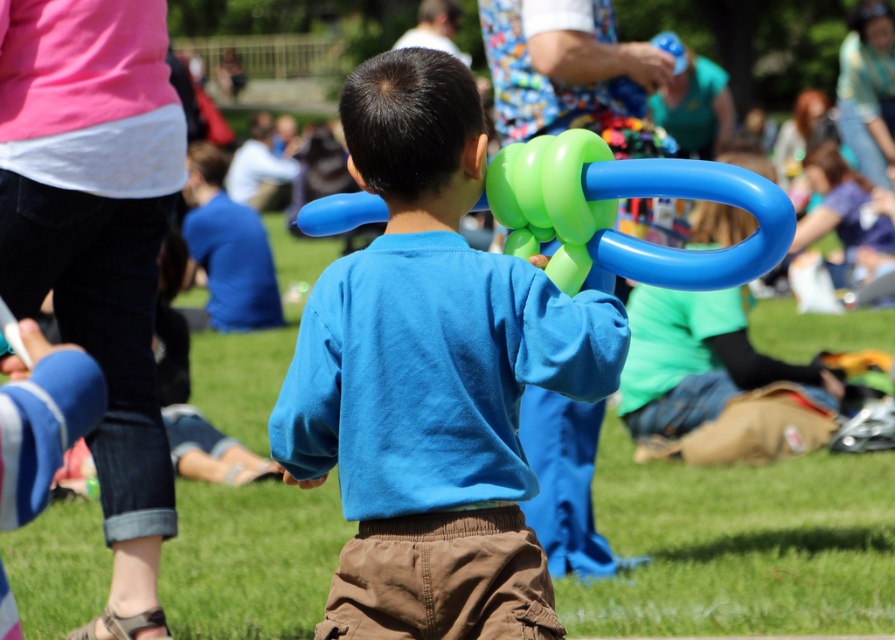
Question: Does blue matte balloon at center appear on the left side of green rubber balloon at center?

Choices:
 (A) yes
 (B) no

Answer: (A)

Question: Which point is closer to the camera?

Choices:
 (A) (594, 259)
 (B) (587, 396)

Answer: (B)

Question: Which point is closer to the camera taking this photo?

Choices:
 (A) (303, 468)
 (B) (659, 253)

Answer: (B)

Question: Can you confirm if blue matte balloon at center is positioned to the right of green rubber balloon at center?

Choices:
 (A) yes
 (B) no

Answer: (B)

Question: Can you confirm if blue matte balloon at center is positioned to the right of green rubber balloon at center?

Choices:
 (A) no
 (B) yes

Answer: (A)

Question: Which object appears farthest from the camera in this image?

Choices:
 (A) blue matte balloon at center
 (B) green rubber balloon at center

Answer: (A)